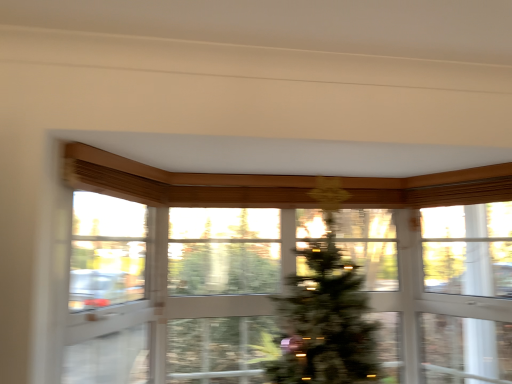
Question: Is green matte christmas tree at center oriented away from transparent glass window at center?

Choices:
 (A) no
 (B) yes

Answer: (B)

Question: Does green matte christmas tree at center have a greater height compared to transparent glass window at center?

Choices:
 (A) no
 (B) yes

Answer: (B)

Question: Is green matte christmas tree at center wider than transparent glass window at center?

Choices:
 (A) yes
 (B) no

Answer: (B)

Question: Considering the relative sizes of green matte christmas tree at center and transparent glass window at center in the image provided, is green matte christmas tree at center smaller than transparent glass window at center?

Choices:
 (A) yes
 (B) no

Answer: (A)

Question: Is green matte christmas tree at center positioned in front of transparent glass window at center?

Choices:
 (A) yes
 (B) no

Answer: (B)

Question: Could you tell me if green matte christmas tree at center is turned towards transparent glass window at center?

Choices:
 (A) yes
 (B) no

Answer: (A)

Question: Does transparent glass screen door at left have a greater width compared to transparent glass window at center?

Choices:
 (A) yes
 (B) no

Answer: (B)

Question: Considering the relative sizes of transparent glass screen door at left and transparent glass window at center in the image provided, is transparent glass screen door at left taller than transparent glass window at center?

Choices:
 (A) yes
 (B) no

Answer: (B)

Question: Can you confirm if transparent glass screen door at left is smaller than transparent glass window at center?

Choices:
 (A) no
 (B) yes

Answer: (B)

Question: Is transparent glass screen door at left shorter than transparent glass window at center?

Choices:
 (A) yes
 (B) no

Answer: (A)

Question: Is transparent glass window at center at the back of transparent glass screen door at left?

Choices:
 (A) yes
 (B) no

Answer: (B)

Question: Does transparent glass screen door at left turn towards transparent glass window at center?

Choices:
 (A) yes
 (B) no

Answer: (A)

Question: Can you confirm if transparent glass window screen at upper right is bigger than green matte christmas tree at center?

Choices:
 (A) no
 (B) yes

Answer: (A)